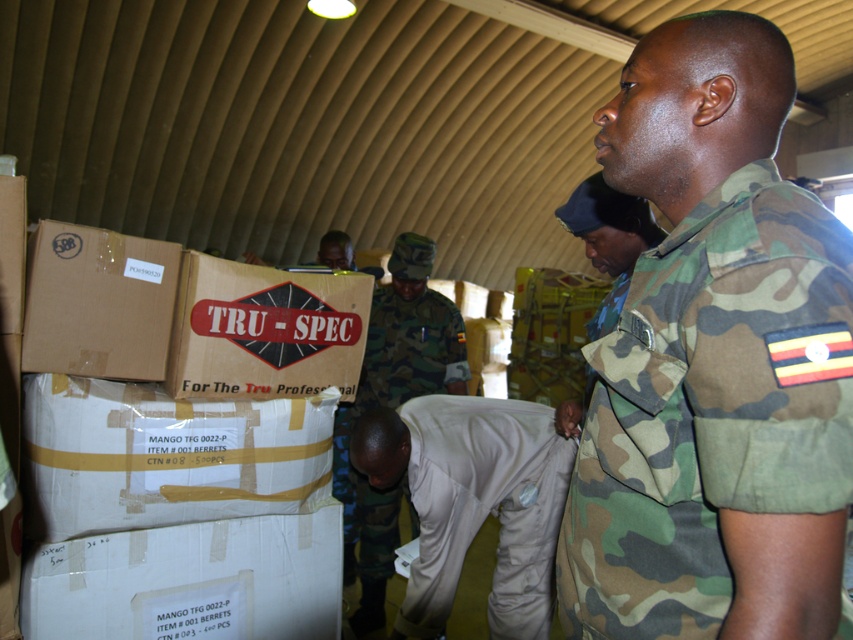
Can you confirm if white cardboard box at lower left is thinner than brown cardboard box at left?

Incorrect, white cardboard box at lower left's width is not less than brown cardboard box at left's.

Can you confirm if white cardboard box at lower left is shorter than brown cardboard box at left?

In fact, white cardboard box at lower left may be taller than brown cardboard box at left.

Describe the element at coordinates (190, 580) in the screenshot. I see `white cardboard box at lower left` at that location.

Image resolution: width=853 pixels, height=640 pixels. I want to click on white cardboard box at lower left, so click(190, 580).

Based on the photo, who is positioned more to the right, camo uniform at center or brown cardboard box at left?

camo uniform at center is more to the right.

Based on the photo, does camo uniform at center have a greater width compared to brown cardboard box at left?

Yes.

Is point (456, 376) closer to camera compared to point (32, 365)?

That is False.

Image resolution: width=853 pixels, height=640 pixels. In order to click on camo uniform at center in this screenshot , I will do `click(393, 408)`.

Can you confirm if camo fabric uniform at center is wider than white cardboard box at center?

No, camo fabric uniform at center is not wider than white cardboard box at center.

Does camo fabric uniform at center appear over white cardboard box at center?

Yes.

Which is in front, point (692, 314) or point (64, 417)?

Point (692, 314) is more forward.

Find the location of a particular element. Image resolution: width=853 pixels, height=640 pixels. camo fabric uniform at center is located at coordinates (709, 408).